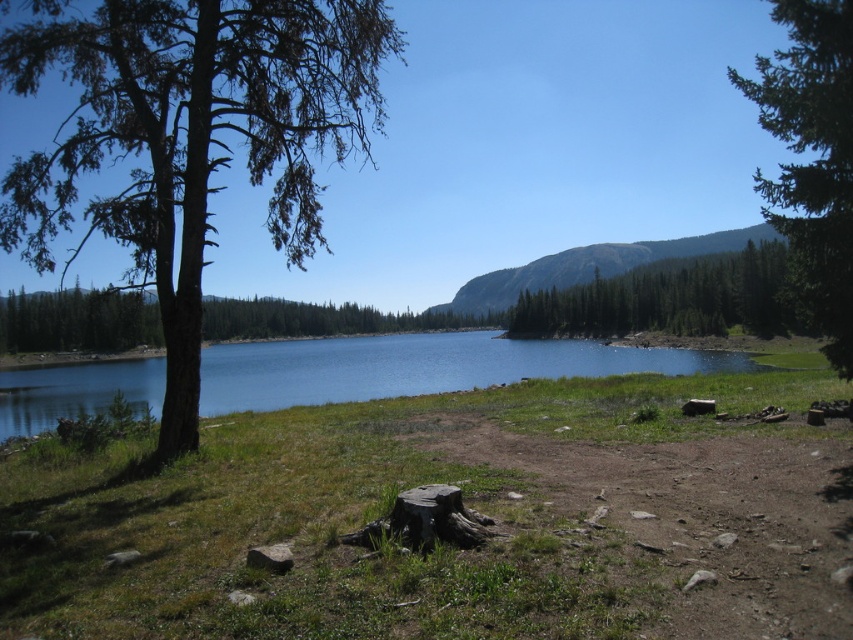
Can you confirm if green textured tree at left is wider than green textured tree at upper right?

Incorrect, green textured tree at left's width does not surpass green textured tree at upper right's.

Which is above, green textured tree at left or green textured tree at upper right?

Positioned higher is green textured tree at upper right.

Where is `green textured tree at left`? green textured tree at left is located at coordinates (189, 136).

Which is more to the right, blue water at center or green textured tree at upper right?

green textured tree at upper right is more to the right.

Which is below, blue water at center or green textured tree at upper right?

blue water at center

Is point (479, 346) in front of point (825, 148)?

No, it is not.

Find the location of a particular element. The width and height of the screenshot is (853, 640). blue water at center is located at coordinates (421, 365).

Can you confirm if green textured tree at left is positioned below green textured tree at upper center?

No.

Is green textured tree at left above green textured tree at upper center?

Correct, green textured tree at left is located above green textured tree at upper center.

Who is more distant from viewer, (358,28) or (526,328)?

The point (526,328) is more distant.

This screenshot has width=853, height=640. In order to click on green textured tree at left in this screenshot , I will do `click(189, 136)`.